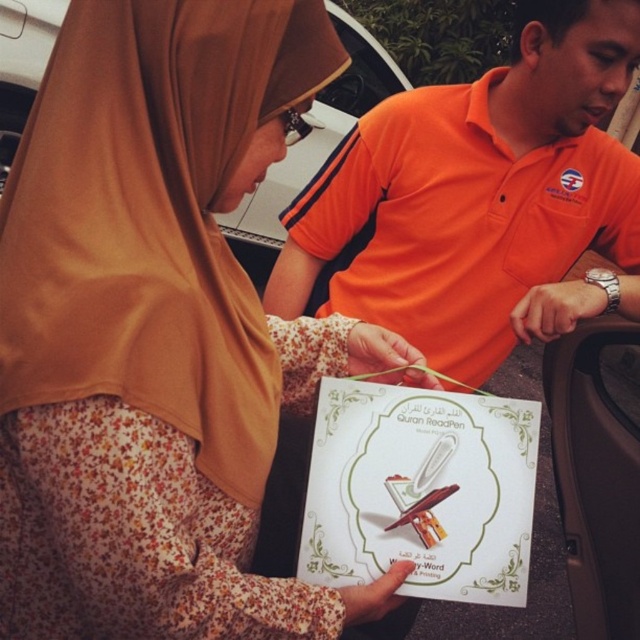
Question: Estimate the real-world distances between objects in this image. Which object is closer to the white plastic car at center?

Choices:
 (A) white paper at center
 (B) orange cotton shirt at center

Answer: (B)

Question: Which of these objects is positioned closest to the white paper at center?

Choices:
 (A) orange cotton shirt at center
 (B) white plastic car at center

Answer: (A)

Question: Among these objects, which one is farthest from the camera?

Choices:
 (A) orange cotton shirt at center
 (B) white paper at center
 (C) white plastic car at center

Answer: (C)

Question: Does orange cotton shirt at center appear over white plastic car at center?

Choices:
 (A) yes
 (B) no

Answer: (B)

Question: Is orange cotton shirt at center bigger than white plastic car at center?

Choices:
 (A) yes
 (B) no

Answer: (B)

Question: Is orange cotton shirt at center smaller than white plastic car at center?

Choices:
 (A) yes
 (B) no

Answer: (A)